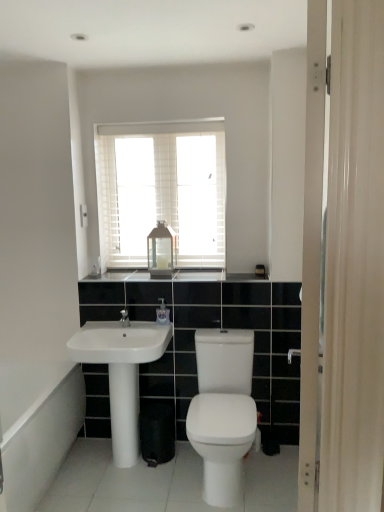
Locate an element on the screen. vacant area situated below white glossy sink at lower left (from a real-world perspective) is located at coordinates (104, 461).